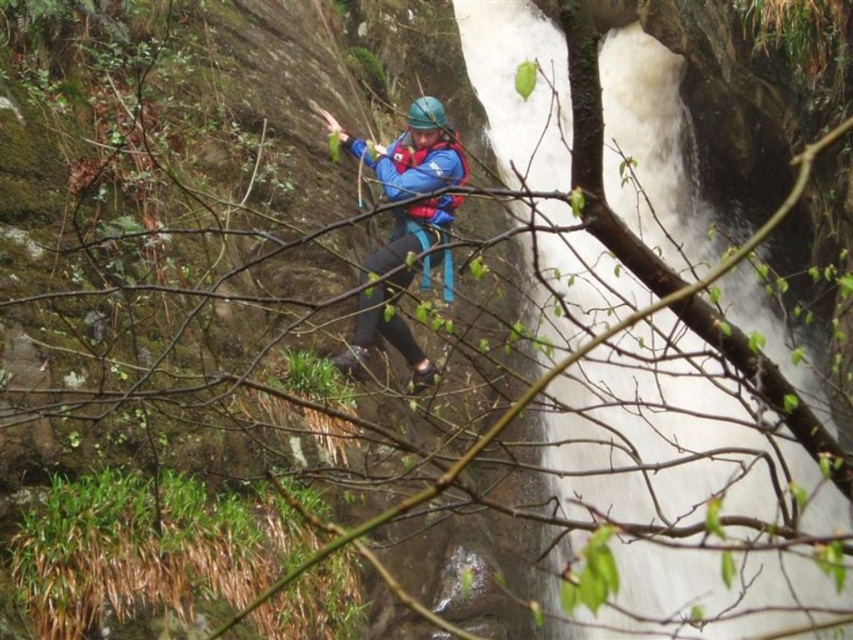
Question: Does white frothy water at center come in front of blue matte life vest at center?

Choices:
 (A) no
 (B) yes

Answer: (B)

Question: Can you confirm if white frothy water at center is thinner than blue matte life vest at center?

Choices:
 (A) yes
 (B) no

Answer: (B)

Question: Does white frothy water at center have a larger size compared to blue matte life vest at center?

Choices:
 (A) yes
 (B) no

Answer: (A)

Question: Which point appears closest to the camera in this image?

Choices:
 (A) (352, 148)
 (B) (650, 380)

Answer: (A)

Question: Which object appears farthest from the camera in this image?

Choices:
 (A) white frothy water at center
 (B) blue matte life vest at center

Answer: (B)

Question: Which of the following is the closest to the observer?

Choices:
 (A) white frothy water at center
 (B) blue matte life vest at center

Answer: (A)